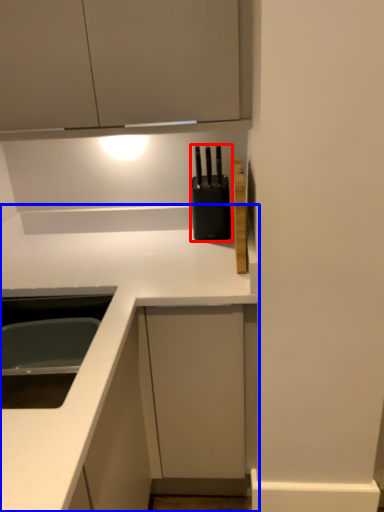
Question: Which object appears farthest to the camera in this image, appliance (highlighted by a red box) or countertop (highlighted by a blue box)?

Choices:
 (A) appliance
 (B) countertop

Answer: (A)